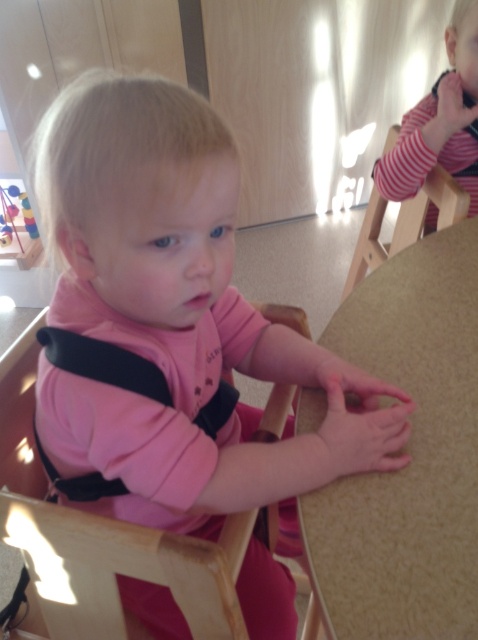
You are a caregiver in a daycare setting. You need to move a baby from the pink matte baby carrier at center to the wooden chair at upper right. Can you do this without needing to move any other furniture?

The distance between the pink matte baby carrier at center and the wooden chair at upper right is 28.33 inches, so yes, you can move the baby from the pink matte baby carrier at center to the wooden chair at upper right without needing to move any other furniture since the space is sufficient.

You are a parent trying to place your baby in the pink matte baby carrier at center so they can watch the other children. However, there is a wooden chair at upper right nearby. Based on the scene, will the carrier block the baby from seeing the other children sitting at the table?

The pink matte baby carrier at center is in front of the wooden chair at upper right, so placing the baby in the carrier may block their view of the other children sitting near the wooden chair at upper right.

You are a photographer trying to capture a closeup of the point at coordinates (463, 381) in the image. Given that the camera can focus on objects within 25 inches, will the point be in focus?

The point at coordinates (463, 381) is 26.01 inches away from the camera, which is beyond the camera focus range of 25 inches. Therefore, the point will not be in focus.